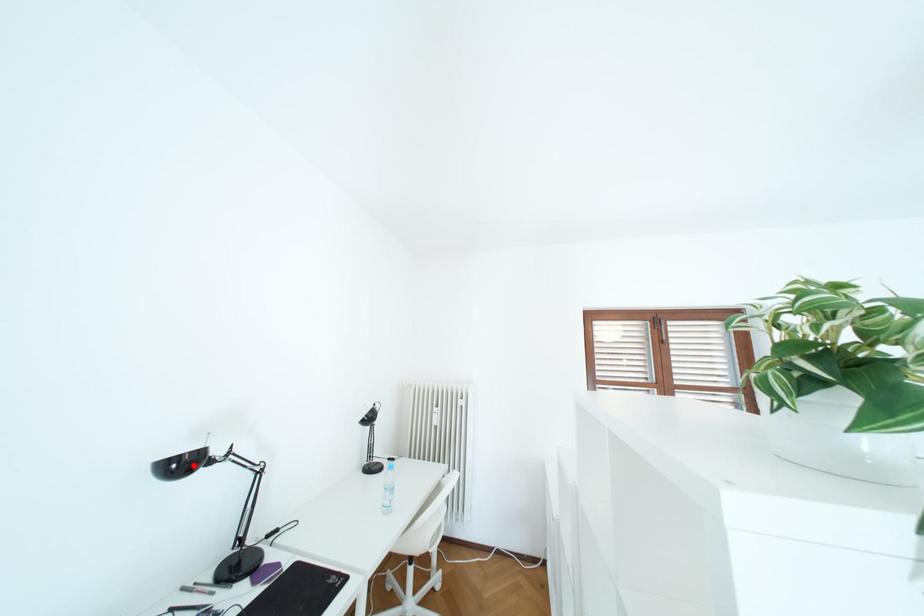
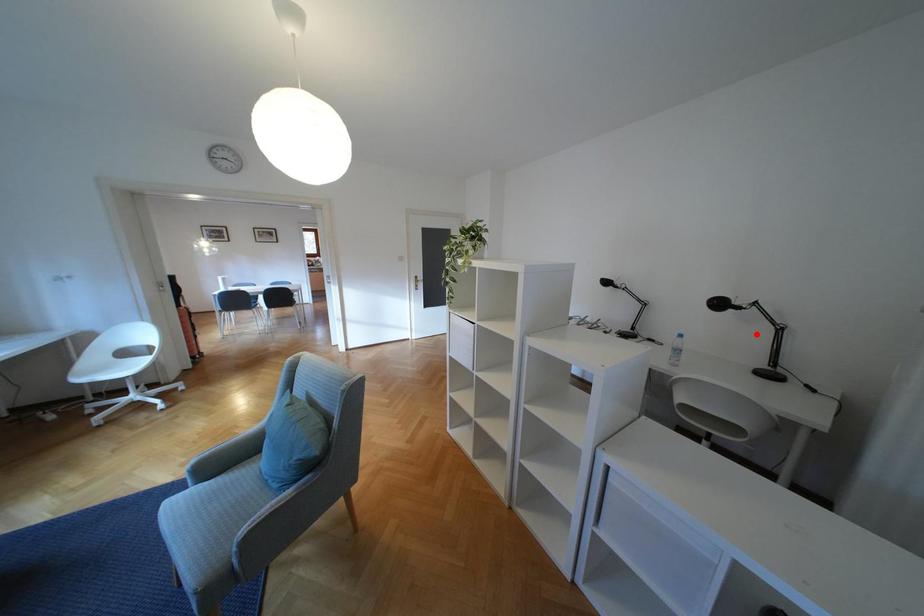
I am providing you with two images of the same scene from different viewpoints. A red point is marked on the first image and another point is marked on the second image. Does the point marked in image1 correspond to the same location as the one in image2?

No